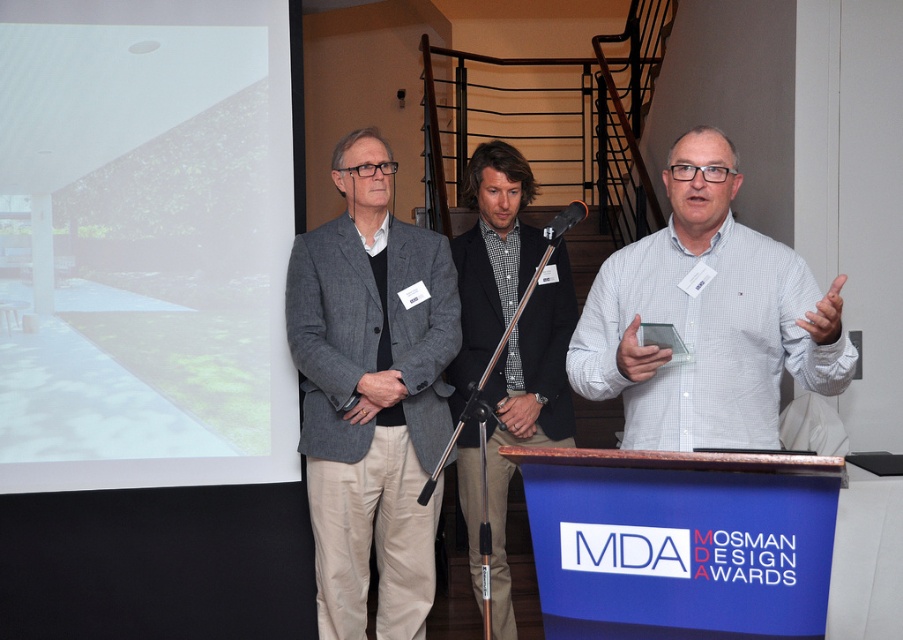
Question: Which point appears farthest from the camera in this image?

Choices:
 (A) (597, 291)
 (B) (500, 186)
 (C) (341, 532)

Answer: (B)

Question: Is gray wool blazer at center smaller than checkered fabric shirt at center?

Choices:
 (A) yes
 (B) no

Answer: (A)

Question: Is the position of white matte projection screen at upper left more distant than that of white checkered shirt at center?

Choices:
 (A) yes
 (B) no

Answer: (A)

Question: Which point appears farthest from the camera in this image?

Choices:
 (A) 625,433
 (B) 494,493
 (C) 368,285

Answer: (B)

Question: Which object appears closest to the camera in this image?

Choices:
 (A) white checkered shirt at center
 (B) gray wool blazer at center
 (C) white matte projection screen at upper left
 (D) checkered fabric shirt at center

Answer: (A)

Question: Where is gray wool blazer at center located in relation to checkered fabric shirt at center in the image?

Choices:
 (A) above
 (B) below

Answer: (A)